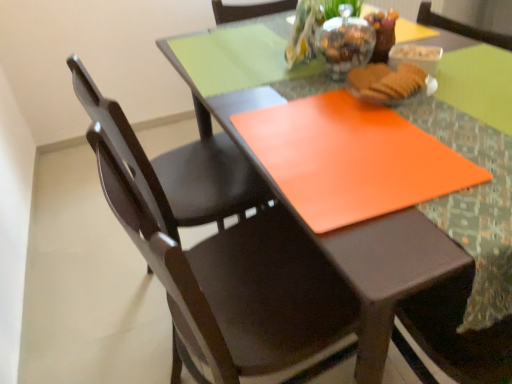
The height and width of the screenshot is (384, 512). In order to click on free space to the left of translucent glass vase at upper center in this screenshot , I will do `click(278, 92)`.